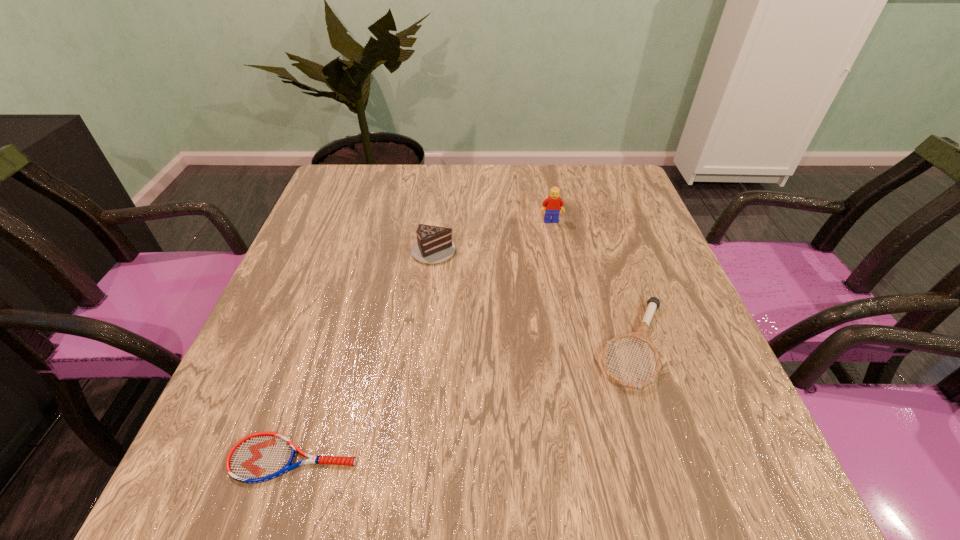
I want to click on free space at the far left corner of the desktop, so click(360, 165).

Locate an element on the screen. Image resolution: width=960 pixels, height=540 pixels. free space between the shortest object and the second farthest object is located at coordinates (364, 354).

You are a GUI agent. You are given a task and a screenshot of the screen. Output one action in this format:
    pyautogui.click(x=<x>, y=<y>)
    Task: Click on the free space that is in between the third object from right to left and the third tallest object
    
    Given the screenshot: What is the action you would take?
    pyautogui.click(x=534, y=297)

At what (x,y) coordinates should I click in order to perform the action: click on vacant point located between the second nearest object and the second object from right to left. Please return your answer as a coordinate pair (x, y). This screenshot has height=540, width=960. Looking at the image, I should click on click(x=592, y=283).

Locate an element on the screen. free space between the nearer tennis racket and the third tallest object is located at coordinates (464, 402).

Where is `vacant area that lies between the left tennis racket and the farthest object`? vacant area that lies between the left tennis racket and the farthest object is located at coordinates (422, 340).

In order to click on free space between the shorter tennis racket and the third nearest object in this screenshot , I will do pos(364,354).

Find the location of a particular element. Image resolution: width=960 pixels, height=540 pixels. free point between the chocolate cake and the taller tennis racket is located at coordinates (534, 297).

The width and height of the screenshot is (960, 540). What are the coordinates of `free point between the nearer tennis racket and the taller tennis racket` in the screenshot? It's located at (464, 402).

You are a GUI agent. You are given a task and a screenshot of the screen. Output one action in this format:
    pyautogui.click(x=<x>, y=<y>)
    Task: Click on the vacant space that is in between the nearer tennis racket and the second nearest object
    The image size is (960, 540).
    Given the screenshot: What is the action you would take?
    pyautogui.click(x=464, y=402)